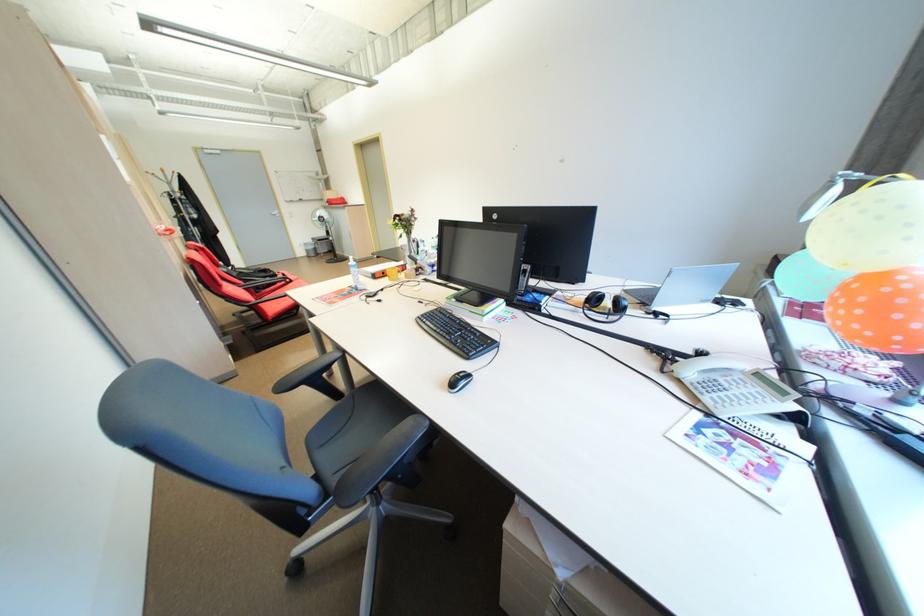
Which object does [322,244] point to?

This point indicates the grey trash can.